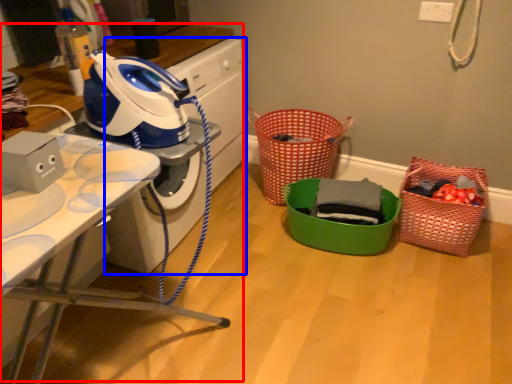
Question: Which object appears farthest to the camera in this image, computer desk (highlighted by a red box) or washing machine (highlighted by a blue box)?

Choices:
 (A) computer desk
 (B) washing machine

Answer: (B)